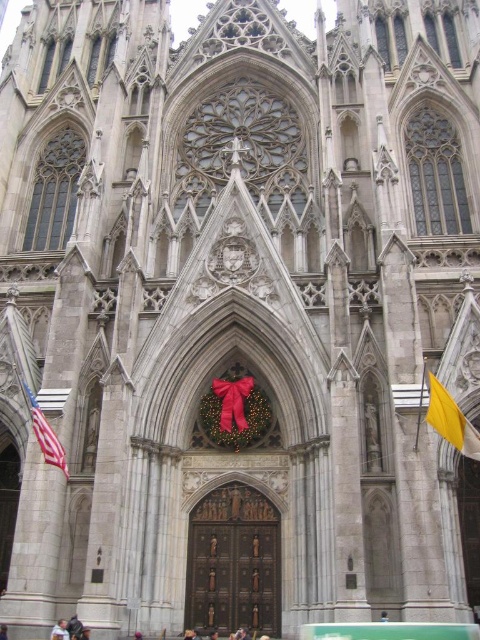
Question: Which point is farther to the camera?

Choices:
 (A) (472, 435)
 (B) (249, 384)

Answer: (B)

Question: From the image, what is the correct spatial relationship of red velvet wreath at center in relation to american flag at left?

Choices:
 (A) right
 (B) left

Answer: (A)

Question: Considering the relative positions of red velvet wreath at center and light blue shirt at center in the image provided, where is red velvet wreath at center located with respect to light blue shirt at center?

Choices:
 (A) below
 (B) above

Answer: (B)

Question: Which object is the farthest from the american flag at left?

Choices:
 (A) red velvet wreath at center
 (B) yellow fabric flag at right

Answer: (B)

Question: Which point is closer to the camera?

Choices:
 (A) (435, 416)
 (B) (60, 620)
 (C) (64, 460)

Answer: (A)

Question: Does red velvet wreath at center have a lesser width compared to american flag at left?

Choices:
 (A) yes
 (B) no

Answer: (B)